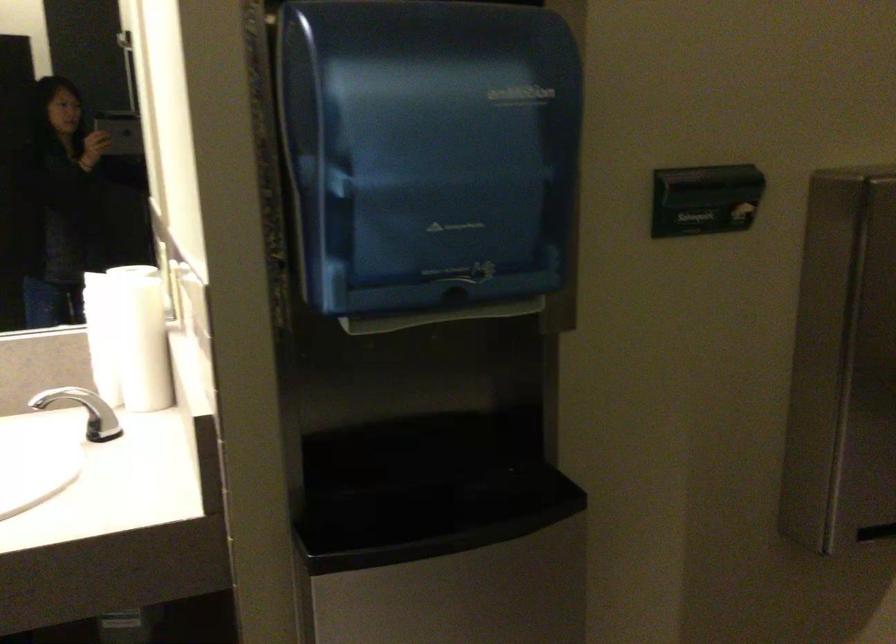
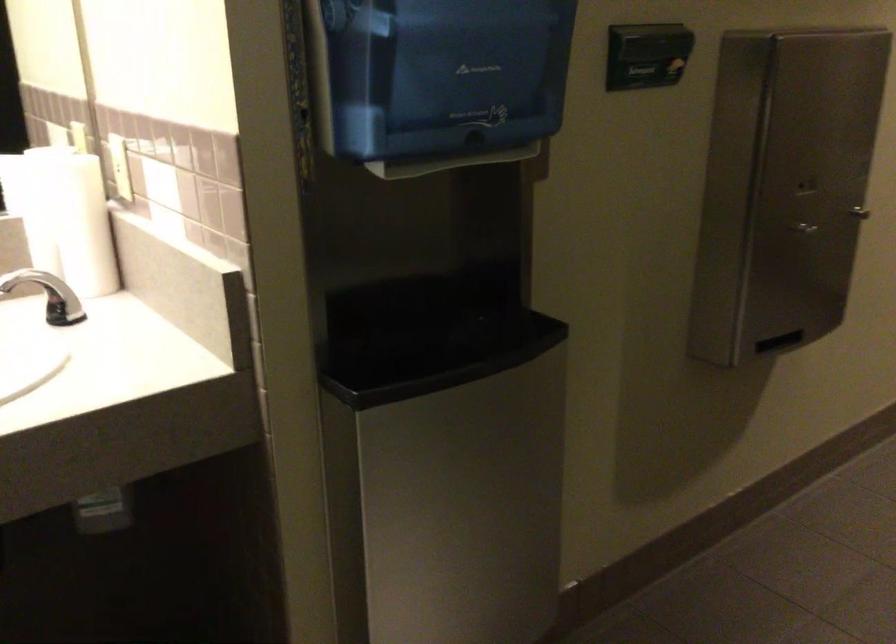
Question: The images are taken continuously from a first-person perspective. In which direction are you moving?

Choices:
 (A) Left
 (B) Right
 (C) Forward
 (D) Backward

Answer: (A)